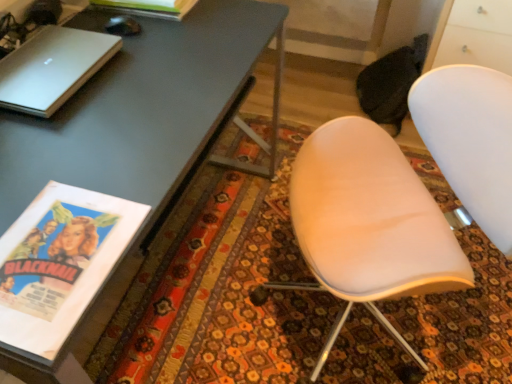
This screenshot has width=512, height=384. I want to click on vacant space in front of black glossy mouse at upper left, so click(x=134, y=61).